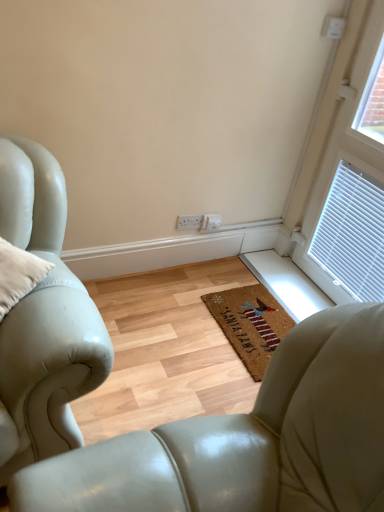
Locate an element on the screen. This screenshot has width=384, height=512. empty space that is ontop of coir mat at center (from a real-world perspective) is located at coordinates (259, 319).